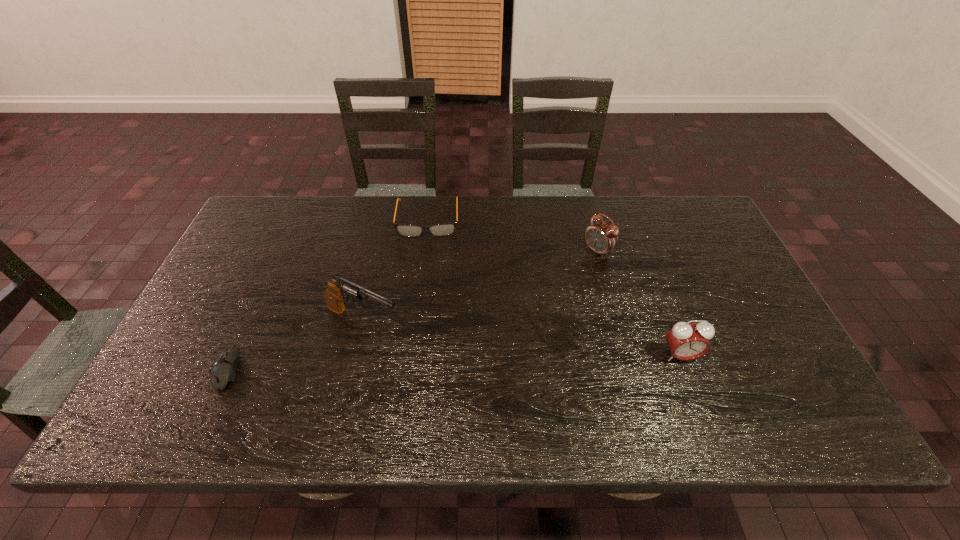
You are a GUI agent. You are given a task and a screenshot of the screen. Output one action in this format:
    pyautogui.click(x=<x>, y=<y>)
    Task: Click on the computer mouse
    
    Given the screenshot: What is the action you would take?
    pyautogui.click(x=223, y=370)

Identify the location of the shortest object. The width and height of the screenshot is (960, 540). (223, 370).

This screenshot has height=540, width=960. I want to click on the nearer alarm clock, so click(687, 341).

Locate an element on the screen. Image resolution: width=960 pixels, height=540 pixels. the rightmost object is located at coordinates (687, 341).

Where is `the third farthest object`? This screenshot has width=960, height=540. the third farthest object is located at coordinates (343, 288).

Image resolution: width=960 pixels, height=540 pixels. What are the coordinates of `the farthest object` in the screenshot? It's located at (442, 229).

Where is `the fourth tallest object`? The image size is (960, 540). the fourth tallest object is located at coordinates (442, 229).

You are a GUI agent. You are given a task and a screenshot of the screen. Output one action in this format:
    pyautogui.click(x=<x>, y=<y>)
    Task: Click on the fourth nearest object
    The height and width of the screenshot is (540, 960).
    Given the screenshot: What is the action you would take?
    pyautogui.click(x=601, y=237)

Find the location of a particular element. the second object from right to left is located at coordinates (601, 237).

At what (x,y) coordinates should I click in order to perform the action: click on vacant region located 0.130m on the back of the shortest object. Please return your answer as a coordinate pair (x, y). Looking at the image, I should click on (257, 303).